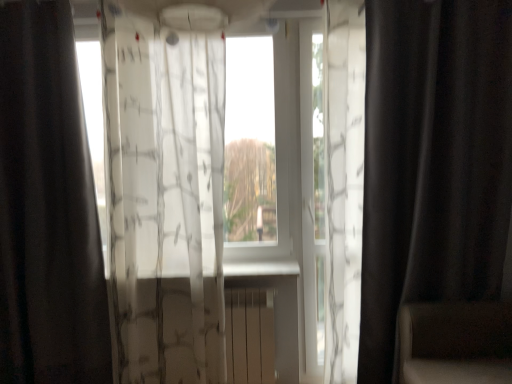
Question: Does black matte curtain at right, which is the third curtain in left-to-right order, turn towards transparent fabric at center?

Choices:
 (A) no
 (B) yes

Answer: (A)

Question: Can you confirm if black matte curtain at right, the 1th curtain from the right, is shorter than transparent fabric at center?

Choices:
 (A) no
 (B) yes

Answer: (A)

Question: Considering the relative positions of black matte curtain at right, which is the third curtain in left-to-right order, and transparent fabric at center in the image provided, is black matte curtain at right, which is the third curtain in left-to-right order, to the right of transparent fabric at center from the viewer's perspective?

Choices:
 (A) no
 (B) yes

Answer: (B)

Question: Is black matte curtain at right, the 1th curtain from the right, with transparent fabric at center?

Choices:
 (A) no
 (B) yes

Answer: (A)

Question: Can we say black matte curtain at right, the 1th curtain from the right, lies outside transparent fabric at center?

Choices:
 (A) no
 (B) yes

Answer: (B)

Question: Choose the correct answer: Is translucent white curtain at center, positioned as the second curtain in left-to-right order, inside black matte curtain at left, which is the 1th curtain in left-to-right order, or outside it?

Choices:
 (A) inside
 (B) outside

Answer: (B)

Question: Considering the positions of translucent white curtain at center, the second curtain in the right-to-left sequence, and black matte curtain at left, which appears as the third curtain when viewed from the right, in the image, is translucent white curtain at center, the second curtain in the right-to-left sequence, bigger or smaller than black matte curtain at left, which appears as the third curtain when viewed from the right,?

Choices:
 (A) big
 (B) small

Answer: (A)

Question: From the image's perspective, is translucent white curtain at center, positioned as the second curtain in left-to-right order, located above or below black matte curtain at left, which appears as the third curtain when viewed from the right?

Choices:
 (A) above
 (B) below

Answer: (B)

Question: Is point (159, 140) positioned closer to the camera than point (69, 148)?

Choices:
 (A) closer
 (B) farther

Answer: (B)

Question: Would you say translucent white curtain at center, the second curtain in the right-to-left sequence, is to the left or to the right of transparent fabric at center in the picture?

Choices:
 (A) right
 (B) left

Answer: (B)

Question: In terms of size, does translucent white curtain at center, the second curtain in the right-to-left sequence, appear bigger or smaller than transparent fabric at center?

Choices:
 (A) big
 (B) small

Answer: (A)

Question: Is translucent white curtain at center, positioned as the second curtain in left-to-right order, taller or shorter than transparent fabric at center?

Choices:
 (A) short
 (B) tall

Answer: (B)

Question: Is translucent white curtain at center, positioned as the second curtain in left-to-right order, in front of or behind transparent fabric at center in the image?

Choices:
 (A) front
 (B) behind

Answer: (A)

Question: Visually, is black matte curtain at left, which appears as the third curtain when viewed from the right, positioned to the left or to the right of translucent white curtain at center, the second curtain in the right-to-left sequence?

Choices:
 (A) left
 (B) right

Answer: (A)

Question: Does point (11, 311) appear closer or farther from the camera than point (118, 36)?

Choices:
 (A) farther
 (B) closer

Answer: (A)